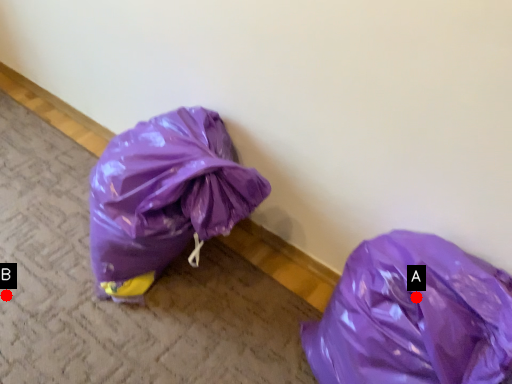
Question: Two points are circled on the image, labeled by A and B beside each circle. Which point is further to the camera?

Choices:
 (A) A is further
 (B) B is further

Answer: (B)